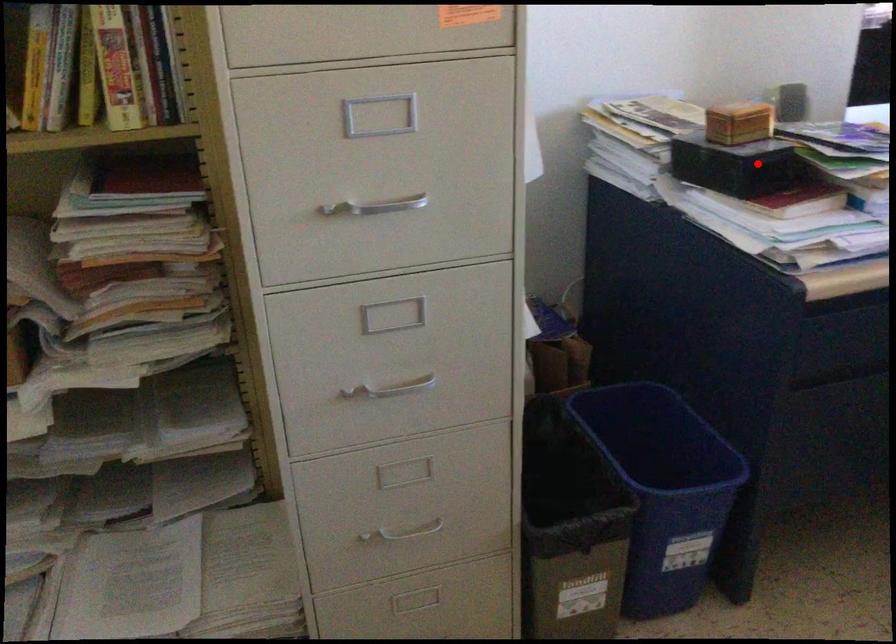
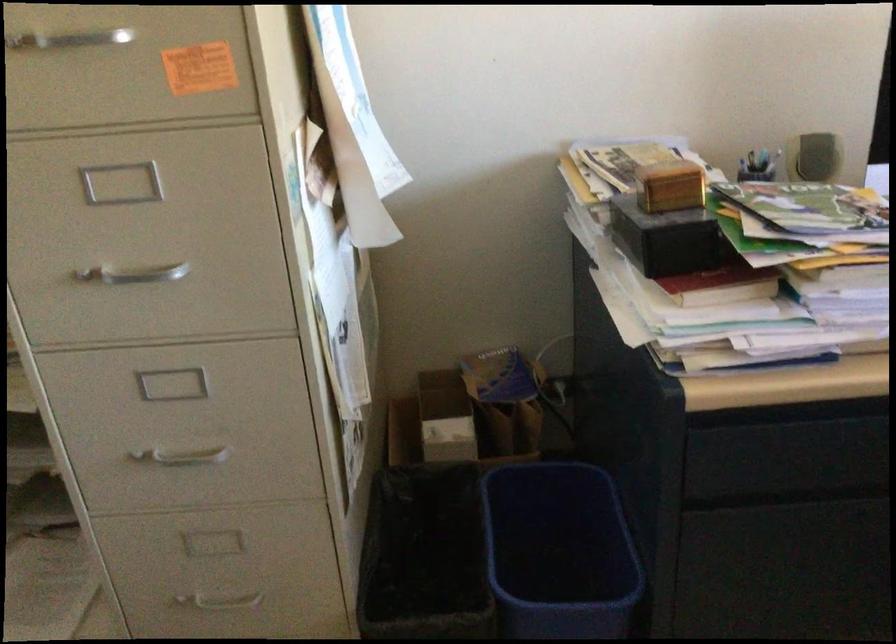
Where in the second image is the point corresponding to the highlighted location from the first image?

(668, 239)